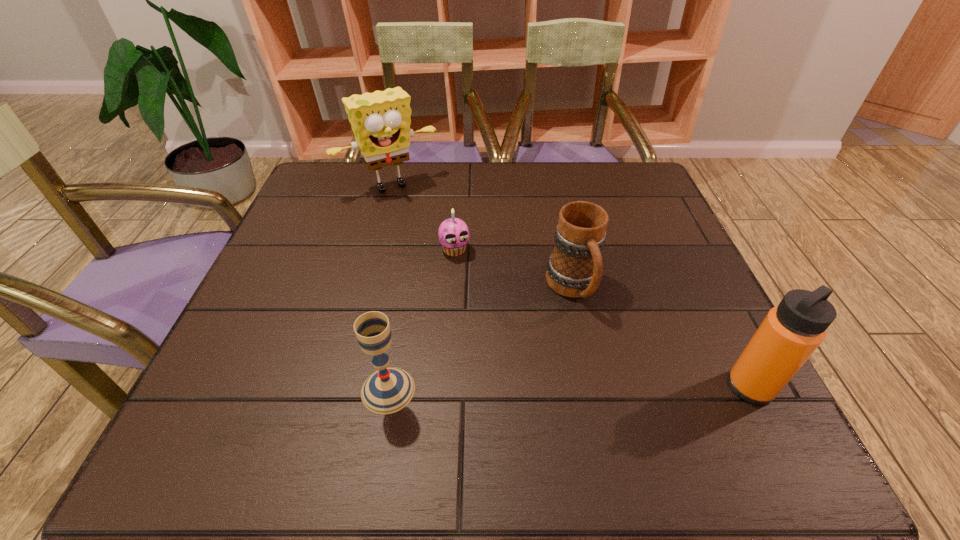
Where is `vacant space located on the face of the third object from left to right`? vacant space located on the face of the third object from left to right is located at coordinates (487, 320).

You are a GUI agent. You are given a task and a screenshot of the screen. Output one action in this format:
    pyautogui.click(x=<x>, y=<y>)
    Task: Click on the vacant space located on the face of the third object from left to right
    
    Given the screenshot: What is the action you would take?
    pyautogui.click(x=467, y=278)

Find the location of `vacant space positioned on the front-facing side of the sponge`. vacant space positioned on the front-facing side of the sponge is located at coordinates (442, 244).

Locate an element on the screen. This screenshot has height=540, width=960. vacant space located on the front-facing side of the sponge is located at coordinates (451, 256).

The image size is (960, 540). Identify the location of free region located on the front-facing side of the sponge. (437, 237).

Where is `free space located on the side of the third farthest object with the handle`? free space located on the side of the third farthest object with the handle is located at coordinates (625, 397).

Identify the location of vacant space located 0.070m on the side of the third farthest object with the handle. (598, 343).

Image resolution: width=960 pixels, height=540 pixels. I want to click on vacant space located 0.100m on the side of the third farthest object with the handle, so click(605, 355).

This screenshot has height=540, width=960. Identify the location of object positioned at the far edge. (381, 120).

In order to click on chalice at the near edge in this screenshot , I will do coord(388,390).